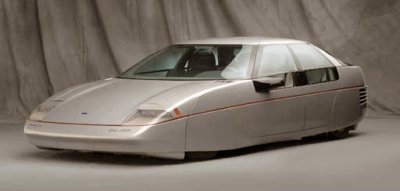
Locate an element on the screen. backdrop is located at coordinates tap(100, 10).